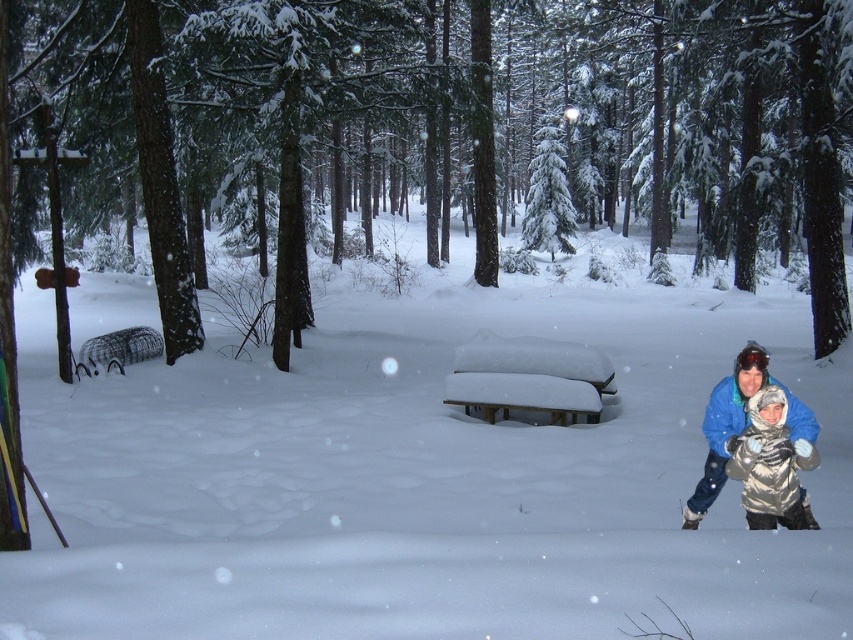
You are planning to take a photo in this winter forest scene. You need to ensure that the brown textured log at center and the silver metallic jacket at lower right are both visible in the frame. Given their sizes, which object will appear larger in the photo?

The brown textured log at center will appear larger in the photo because it is taller than the silver metallic jacket at lower right.

You are planning to place a small gift box on the silver metallic jacket at lower right. However, you want to ensure it won not be buried by the snow. Based on the scene description, where should you position the gift box relative to the brown textured log at center?

The brown textured log at center is above the silver metallic jacket at lower right, so positioning the gift box below the brown textured log at center would place it on the silver metallic jacket at lower right without being buried by snow.